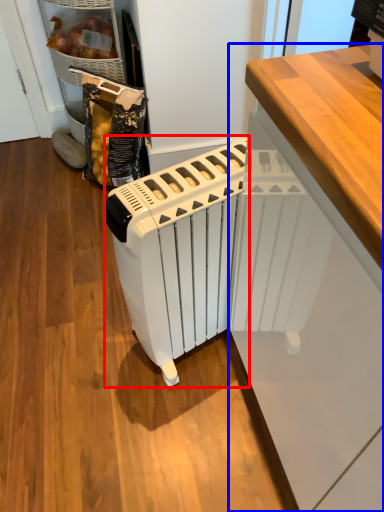
Question: Which of the following is the closest to the observer, home appliance (highlighted by a red box) or cabinetry (highlighted by a blue box)?

Choices:
 (A) home appliance
 (B) cabinetry

Answer: (B)